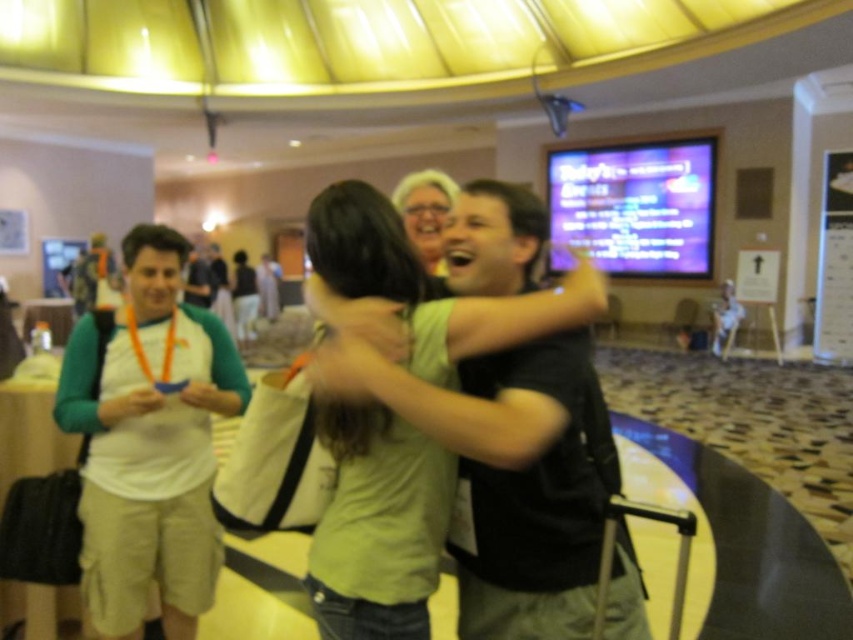
You are attending this event and need to find a coat rack that can accommodate both your green matte shirt at center and white fabric shirt at left. Considering their heights, which shirt will require a taller hanger?

The white fabric shirt at left is taller than the green matte shirt at center, so it will require a taller hanger.

You are organizing a photo shoot and need to ensure that the green matte shirt at center and the white fabric shirt at left are visible in the frame. Based on their sizes, which one might require more careful framing to avoid being cut off?

The green matte shirt at center occupies less space than the white fabric shirt at left, so the white fabric shirt at left might require more careful framing to avoid being cut off due to its larger size.